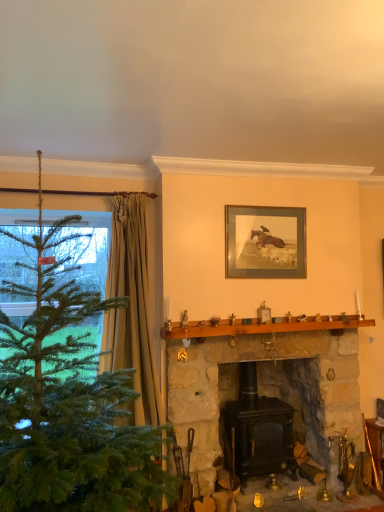
At what (x,y) coordinates should I click in order to perform the action: click on free region under wooden frame at upper center (from a real-world perspective). Please return your answer as a coordinate pair (x, y). Looking at the image, I should click on (254, 318).